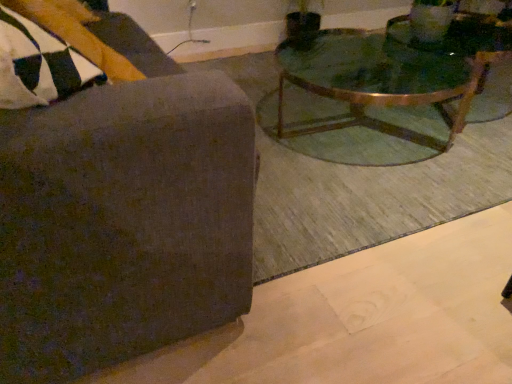
Describe the element at coordinates (123, 216) in the screenshot. I see `dark gray fabric chair at upper left` at that location.

I want to click on dark gray fabric chair at upper left, so click(123, 216).

Image resolution: width=512 pixels, height=384 pixels. In order to click on green glass coffee table at upper right in this screenshot , I will do `click(370, 96)`.

The width and height of the screenshot is (512, 384). What do you see at coordinates (370, 96) in the screenshot? I see `green glass coffee table at upper right` at bounding box center [370, 96].

The width and height of the screenshot is (512, 384). I want to click on dark gray fabric chair at upper left, so click(x=123, y=216).

In the scene shown: Which object is positioned more to the left, dark gray fabric chair at upper left or green glass coffee table at upper right?

Positioned to the left is dark gray fabric chair at upper left.

Is dark gray fabric chair at upper left closer to the viewer compared to green glass coffee table at upper right?

Yes, dark gray fabric chair at upper left is closer to the camera.

Does point (42, 131) come in front of point (345, 79)?

That is True.

Looking at this image, from the image's perspective, which object appears higher, dark gray fabric chair at upper left or green glass coffee table at upper right?

green glass coffee table at upper right is shown above in the image.

From a real-world perspective, is dark gray fabric chair at upper left on green glass coffee table at upper right?

Yes, from a real-world perspective, dark gray fabric chair at upper left is on top of green glass coffee table at upper right.

Considering the relative sizes of dark gray fabric chair at upper left and green glass coffee table at upper right in the image provided, is dark gray fabric chair at upper left wider than green glass coffee table at upper right?

No.

Considering the relative sizes of dark gray fabric chair at upper left and green glass coffee table at upper right in the image provided, is dark gray fabric chair at upper left shorter than green glass coffee table at upper right?

In fact, dark gray fabric chair at upper left may be taller than green glass coffee table at upper right.

Considering the sizes of objects dark gray fabric chair at upper left and green glass coffee table at upper right in the image provided, who is bigger, dark gray fabric chair at upper left or green glass coffee table at upper right?

green glass coffee table at upper right is bigger.

Is green glass coffee table at upper right a part of dark gray fabric chair at upper left?

Definitely not — green glass coffee table at upper right is not inside dark gray fabric chair at upper left.

Does dark gray fabric chair at upper left touch green glass coffee table at upper right?

dark gray fabric chair at upper left and green glass coffee table at upper right are clearly separated.

Is dark gray fabric chair at upper left positioned with its back to green glass coffee table at upper right?

No, green glass coffee table at upper right is not at the back of dark gray fabric chair at upper left.

The width and height of the screenshot is (512, 384). I want to click on coffee table that appears above the dark gray fabric chair at upper left (from the image's perspective), so click(370, 96).

Is green glass coffee table at upper right at the left side of dark gray fabric chair at upper left?

No.

Is green glass coffee table at upper right in front of or behind dark gray fabric chair at upper left in the image?

In the image, green glass coffee table at upper right appears behind dark gray fabric chair at upper left.

Considering the points (449, 56) and (157, 202), which point is behind, point (449, 56) or point (157, 202)?

The point (449, 56) is more distant.

From the image's perspective, which one is positioned lower, green glass coffee table at upper right or dark gray fabric chair at upper left?

dark gray fabric chair at upper left appears lower in the image.

From a real-world perspective, is green glass coffee table at upper right on top of dark gray fabric chair at upper left?

Incorrect, from a real-world perspective, green glass coffee table at upper right is lower than dark gray fabric chair at upper left.

Does green glass coffee table at upper right have a greater width compared to dark gray fabric chair at upper left?

Yes.

Between green glass coffee table at upper right and dark gray fabric chair at upper left, which one has more height?

dark gray fabric chair at upper left.

Who is smaller, green glass coffee table at upper right or dark gray fabric chair at upper left?

With smaller size is dark gray fabric chair at upper left.

Is green glass coffee table at upper right spatially inside dark gray fabric chair at upper left, or outside of it?

green glass coffee table at upper right is spatially situated outside dark gray fabric chair at upper left.

Is green glass coffee table at upper right not near dark gray fabric chair at upper left?

That's right, there is a large distance between green glass coffee table at upper right and dark gray fabric chair at upper left.

Is green glass coffee table at upper right facing away from dark gray fabric chair at upper left?

That's not correct — green glass coffee table at upper right is not looking away from dark gray fabric chair at upper left.

You are a GUI agent. You are given a task and a screenshot of the screen. Output one action in this format:
    pyautogui.click(x=<x>, y=<y>)
    Task: Click on the coffee table that appears above the dark gray fabric chair at upper left (from the image's perspective)
    The width and height of the screenshot is (512, 384).
    Given the screenshot: What is the action you would take?
    pos(370,96)

I want to click on chair on the left of the green glass coffee table at upper right, so click(123, 216).

Locate an element on the screen. This screenshot has width=512, height=384. coffee table above the dark gray fabric chair at upper left (from the image's perspective) is located at coordinates (370, 96).